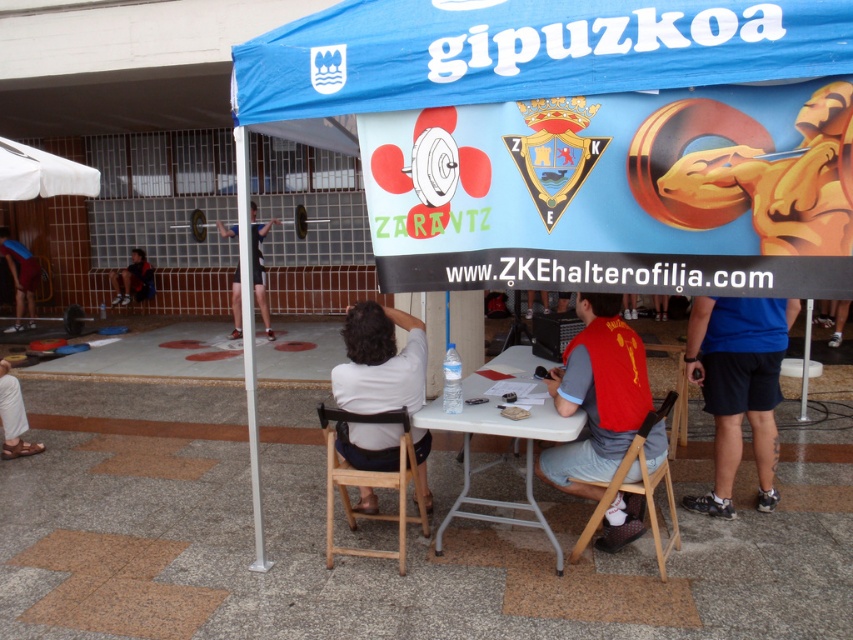
You are standing at the entrance of the event area and want to approach the table to sign up for an event. Given that the white plastic table at center is in front of the white fabric canopy at upper left, which object should you look for first to locate the table?

You should first look for the white fabric canopy at upper left because the white plastic table at center is positioned in front of it, so the canopy will help guide you to the table.

You are setting up for an event and have a white plastic table at center and a white fabric canopy at upper left. Which object requires more space to accommodate its size?

The white plastic table at center requires more space because it is larger in size than the white fabric canopy at upper left.

You are planning to set up a booth under the white fabric canopy at upper left and need to place a 2.5 meter long banner. Considering the canopy and the dark blue shorts at lower left, will the banner fit horizontally under the canopy?

The white fabric canopy at upper left has a width less than the dark blue shorts at lower left. Since the dark blue shorts at lower left are part of a person seated at lower left, it is unclear how their width relates to the canopy. Therefore, it is uncertain if the banner will fit horizontally under the canopy.